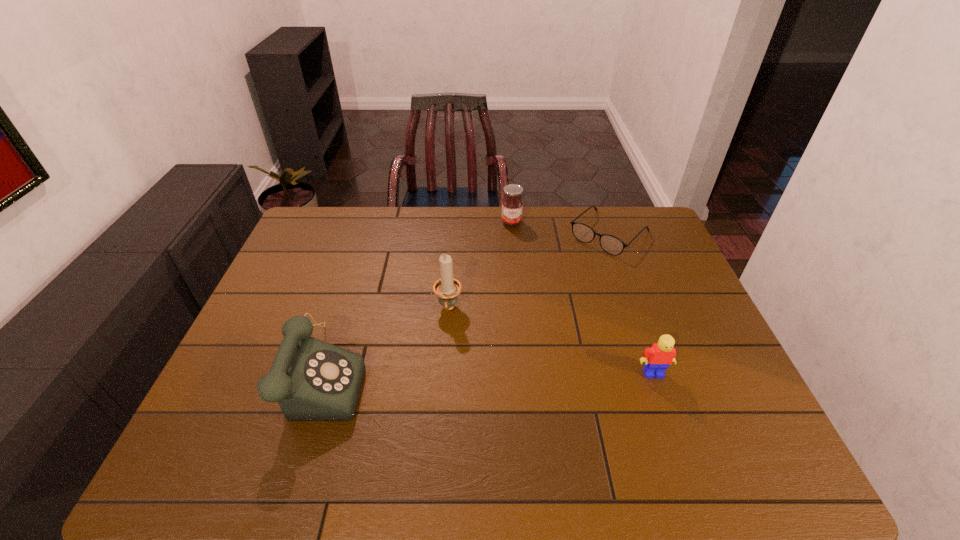
At what (x,y) coordinates should I click in order to perform the action: click on vacant area situated on the label side of the jam. Please return your answer as a coordinate pair (x, y). Looking at the image, I should click on (514, 241).

You are a GUI agent. You are given a task and a screenshot of the screen. Output one action in this format:
    pyautogui.click(x=<x>, y=<y>)
    Task: Click on the vacant space located on the label side of the jam
    
    Given the screenshot: What is the action you would take?
    pyautogui.click(x=521, y=308)

Identify the location of vacant point located 0.330m on the front-facing side of the shortest object. This screenshot has width=960, height=540. (532, 310).

Find the location of a particular element. vacant region located on the front-facing side of the shortest object is located at coordinates (578, 265).

I want to click on vacant space located 0.160m on the front-facing side of the shortest object, so click(564, 280).

This screenshot has height=540, width=960. In order to click on vacant region located on the handle side of the third nearest object in this screenshot , I will do `click(445, 343)`.

You are a GUI agent. You are given a task and a screenshot of the screen. Output one action in this format:
    pyautogui.click(x=<x>, y=<y>)
    Task: Click on the free region located on the handle side of the third nearest object
    This screenshot has height=540, width=960.
    Given the screenshot: What is the action you would take?
    pyautogui.click(x=442, y=381)

Locate an element on the screen. The image size is (960, 540). vacant space positioned on the handle side of the third nearest object is located at coordinates (439, 406).

You are a GUI agent. You are given a task and a screenshot of the screen. Output one action in this format:
    pyautogui.click(x=<x>, y=<y>)
    Task: Click on the jam present at the far edge
    The height and width of the screenshot is (540, 960).
    Given the screenshot: What is the action you would take?
    pyautogui.click(x=512, y=204)

This screenshot has width=960, height=540. I want to click on spectacles at the far edge, so click(612, 245).